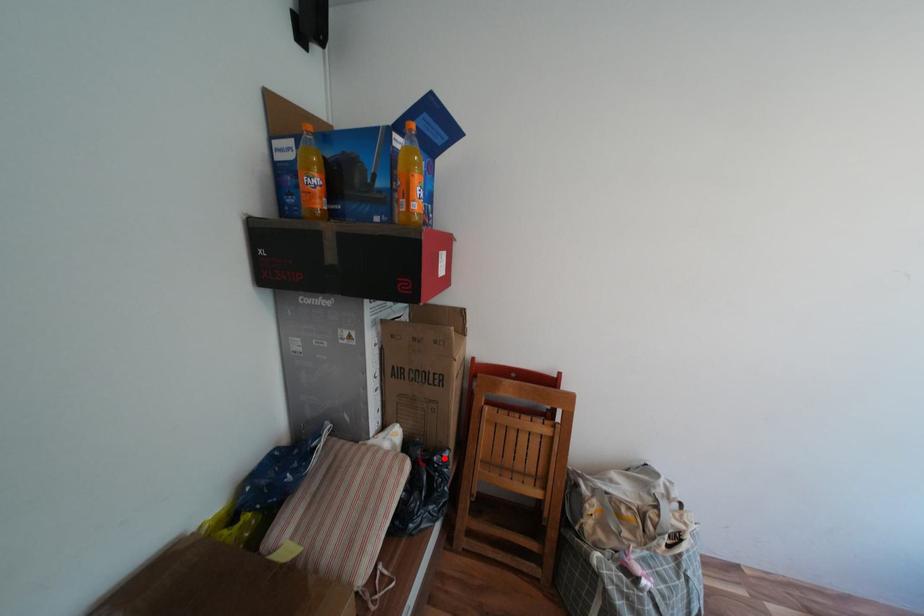
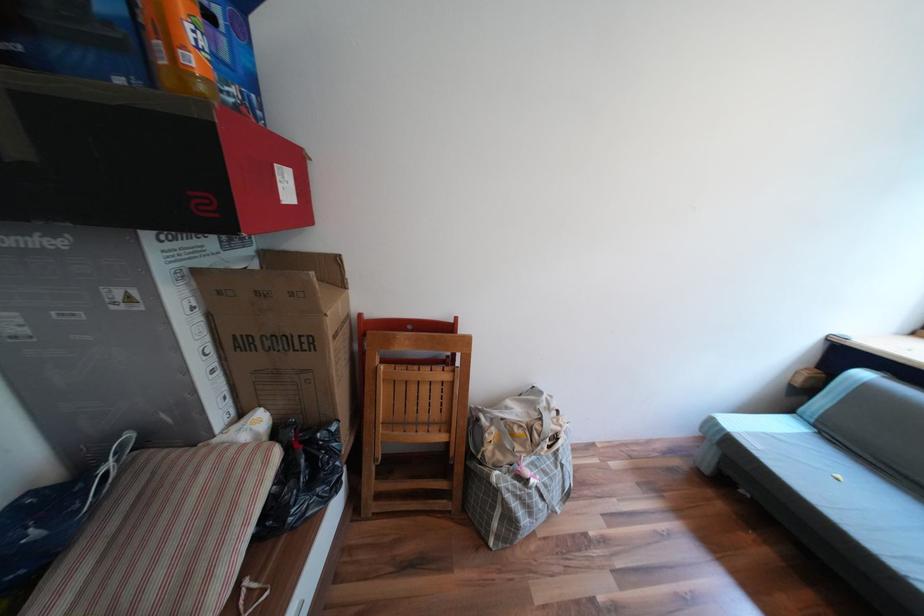
Where in the second image is the point corresponding to the highlighted location from the first image?

(327, 435)